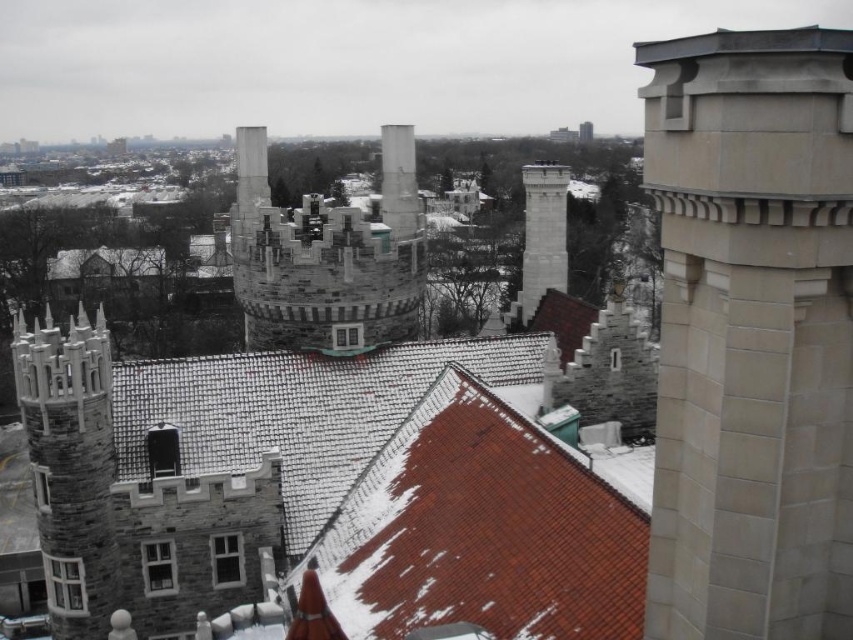
In the scene shown: You are standing at the vantage point overlooking the snow scene. You notice two points marked in the image. The first is at coordinate point (33, 371) and the second is at coordinate point (524, 172). Which point is closer to your current position?

Point (33, 371) is in front of point (524, 172), so it is closer to your current position.